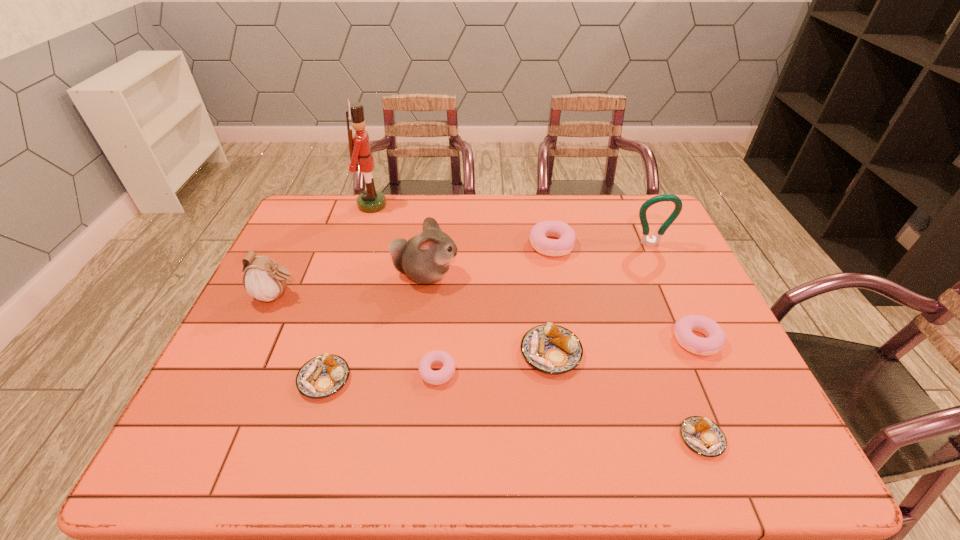
Locate an element on the screen. free point between the bottle opener and the biggest brown pastry is located at coordinates (601, 299).

Find the location of a particular element. Image resolution: width=960 pixels, height=540 pixels. vacant point located between the rightmost pink pastry and the nearest brown pastry is located at coordinates (699, 389).

Identify the location of empty space between the farthest object and the rightmost pink pastry. This screenshot has width=960, height=540. (535, 273).

Where is `free area in between the second pastry from left to right and the fourth tallest object`? The image size is (960, 540). free area in between the second pastry from left to right and the fourth tallest object is located at coordinates (357, 334).

Where is `vacant space that's between the nearest pastry and the green bottle opener`? The image size is (960, 540). vacant space that's between the nearest pastry and the green bottle opener is located at coordinates (676, 341).

Find the location of `vacant space that's between the smallest brown pastry and the farthest pink pastry`. vacant space that's between the smallest brown pastry and the farthest pink pastry is located at coordinates (627, 341).

Find the location of `free space between the white hamster and the leftmost brown pastry`. free space between the white hamster and the leftmost brown pastry is located at coordinates (375, 327).

You are a GUI agent. You are given a task and a screenshot of the screen. Output one action in this format:
    pyautogui.click(x=<x>, y=<y>)
    Task: Click on the free spot between the green bottle opener and the hamster
    This screenshot has width=960, height=540.
    Given the screenshot: What is the action you would take?
    pyautogui.click(x=539, y=260)

At what (x,y) coordinates should I click in order to perform the action: click on the fifth closest object to the second brown pastry from left to right. Please return your answer as a coordinate pair (x, y). This screenshot has height=540, width=960. Looking at the image, I should click on (566, 236).

Select which object is the closest to the leftmost brown pastry. Please provide its 2D coordinates. Your answer should be formatted as a tuple, i.e. [(x, y)], where the tuple contains the x and y coordinates of a point satisfying the conditions above.

[(439, 377)]